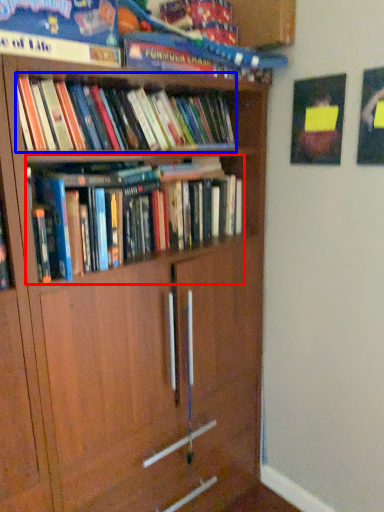
Question: Among these objects, which one is farthest to the camera, book (highlighted by a red box) or book (highlighted by a blue box)?

Choices:
 (A) book
 (B) book

Answer: (A)